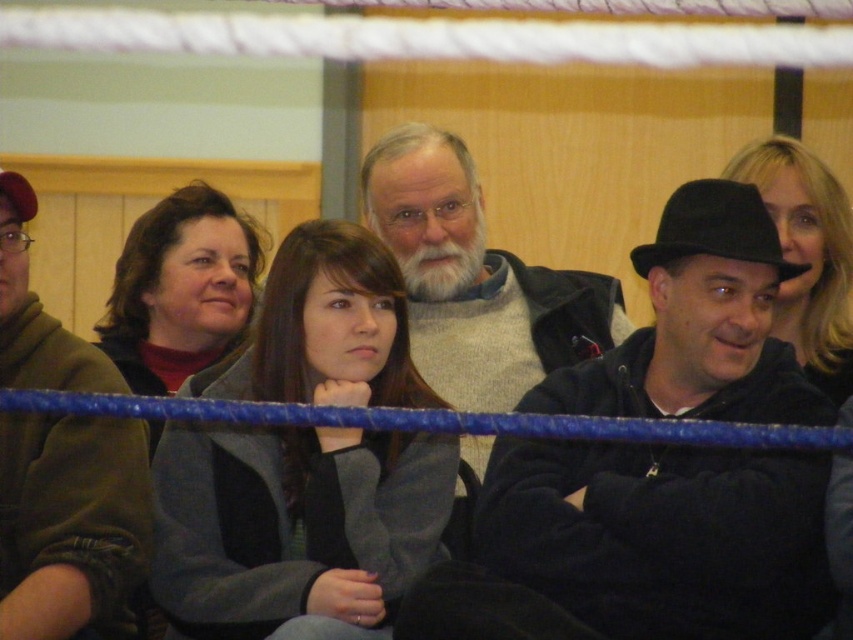
You are organizing a charity event and need to arrange two items for a photo shoot. You have a black felt hat at right and a gray wool sweater at center. If you want to place them side by side on a shelf, which item should you place first to ensure they both fit without overlapping?

The black felt hat at right has a larger size compared to the gray wool sweater at center, so you should place the black felt hat at right first to accommodate its larger size before placing the gray wool sweater at center.